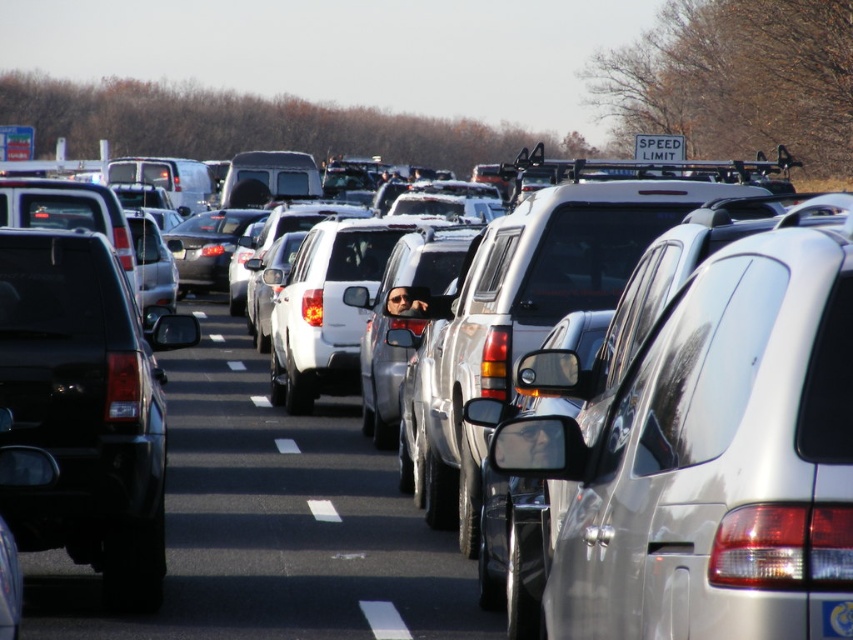
Question: Considering the real-world distances, which object is closest to the matte black suv at left?

Choices:
 (A) black plastic license plate at center
 (B) white glossy car at center

Answer: (A)

Question: Estimate the real-world distances between objects in this image. Which object is closer to the black plastic license plate at center?

Choices:
 (A) matte black suv at left
 (B) white glossy car at center

Answer: (A)

Question: Does white glossy car at center have a lesser width compared to black plastic license plate at center?

Choices:
 (A) yes
 (B) no

Answer: (B)

Question: Which object is positioned farthest from the matte black suv at left?

Choices:
 (A) white glossy car at center
 (B) black plastic license plate at center

Answer: (A)

Question: Can you confirm if matte black suv at left is thinner than black plastic license plate at center?

Choices:
 (A) yes
 (B) no

Answer: (B)

Question: Can you confirm if white glossy car at center is smaller than matte black suv at left?

Choices:
 (A) yes
 (B) no

Answer: (B)